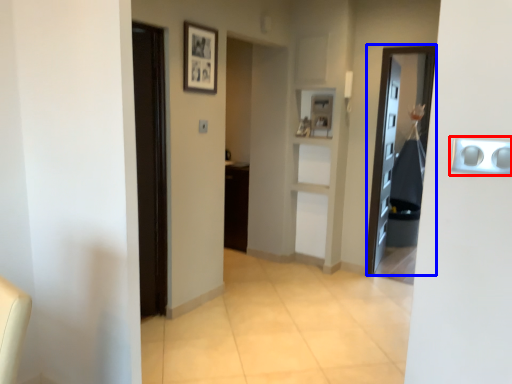
Question: Which object appears closest to the camera in this image, door handle (highlighted by a red box) or door (highlighted by a blue box)?

Choices:
 (A) door handle
 (B) door

Answer: (A)